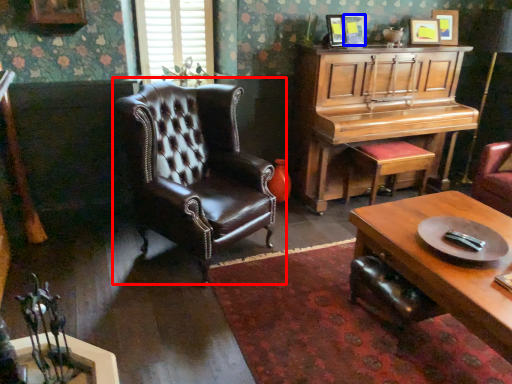
Question: Which point is further to the camera, chair (highlighted by a red box) or picture frame (highlighted by a blue box)?

Choices:
 (A) chair
 (B) picture frame

Answer: (B)